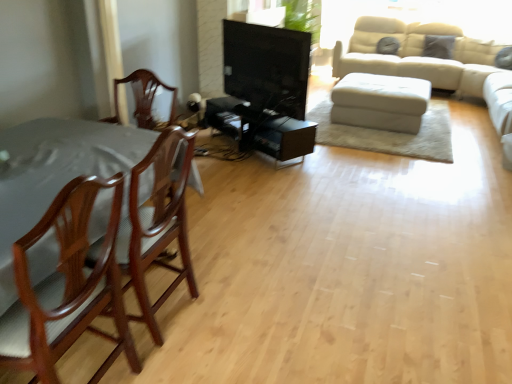
This screenshot has width=512, height=384. What do you see at coordinates (67, 287) in the screenshot? I see `mahogany wood chair at left, the second chair positioned from the back` at bounding box center [67, 287].

What do you see at coordinates (158, 223) in the screenshot? The image size is (512, 384). I see `mahogany wood chair at left, which is the first chair from back to front` at bounding box center [158, 223].

This screenshot has height=384, width=512. What do you see at coordinates (380, 102) in the screenshot?
I see `white leather ottoman at center` at bounding box center [380, 102].

Identify the location of mahogany wood chair at left, the second chair positioned from the back. This screenshot has height=384, width=512. (67, 287).

Between point (411, 124) and point (307, 37), which one is positioned behind?

The point (411, 124) is more distant.

Could you tell me if white leather ottoman at center is turned towards black glossy tv stand at center?

No, white leather ottoman at center is not facing towards black glossy tv stand at center.

Is white leather ottoman at center far from black glossy tv stand at center?

Yes, white leather ottoman at center and black glossy tv stand at center are quite far apart.

Which of these two, white leather ottoman at center or black glossy tv stand at center, is bigger?

white leather ottoman at center is bigger.

In the image, is white leather ottoman at center on the left side or the right side of mahogany wood chair at left, the second chair viewed from the front?

From the image, it's evident that white leather ottoman at center is to the right of mahogany wood chair at left, the second chair viewed from the front.

Is the surface of white leather ottoman at center in direct contact with mahogany wood chair at left, the second chair viewed from the front?

There is a gap between white leather ottoman at center and mahogany wood chair at left, the second chair viewed from the front.

From the image's perspective, which is above, white leather ottoman at center or mahogany wood chair at left, the second chair viewed from the front?

white leather ottoman at center is shown above in the image.

Would you say white leather ottoman at center contains mahogany wood chair at left, the second chair viewed from the front?

Definitely not — mahogany wood chair at left, the second chair viewed from the front, is not inside white leather ottoman at center.

Who is shorter, mahogany wood chair at left, which is the first chair from back to front, or black glossy tv stand at center?

Standing shorter between the two is black glossy tv stand at center.

From the image's perspective, which object appears higher, mahogany wood chair at left, the second chair viewed from the front, or black glossy tv stand at center?

black glossy tv stand at center is shown above in the image.

Considering the relative sizes of mahogany wood chair at left, the second chair viewed from the front, and black glossy tv stand at center in the image provided, is mahogany wood chair at left, the second chair viewed from the front, smaller than black glossy tv stand at center?

No, mahogany wood chair at left, the second chair viewed from the front, is not smaller than black glossy tv stand at center.

Considering the relative positions of mahogany wood chair at left, the second chair viewed from the front, and black glossy tv stand at center in the image provided, is mahogany wood chair at left, the second chair viewed from the front, behind black glossy tv stand at center?

No, mahogany wood chair at left, the second chair viewed from the front, is in front of black glossy tv stand at center.

Between point (255, 128) and point (164, 237), which one is positioned behind?

The point (255, 128) is behind.

Measure the distance between black glossy tv stand at center and mahogany wood chair at left, which is the first chair from back to front.

6.34 feet.

Which of these two, black glossy tv stand at center or mahogany wood chair at left, the second chair viewed from the front, is bigger?

Bigger between the two is mahogany wood chair at left, the second chair viewed from the front.

Between black glossy tv stand at center and mahogany wood chair at left, which is the first chair from back to front, which one has less height?

black glossy tv stand at center.

Is white leather ottoman at center aimed at mahogany wood chair at left, the second chair positioned from the back?

Yes, white leather ottoman at center is turned towards mahogany wood chair at left, the second chair positioned from the back.

From a real-world perspective, count 1st chairs upward from the white leather ottoman at center and point to it. Please provide its 2D coordinates.

[(67, 287)]

Is point (416, 92) positioned before point (35, 342)?

No, it is behind (35, 342).

Which of these two, black glossy tv stand at center or white leather ottoman at center, is wider?

white leather ottoman at center.

From the image's perspective, is black glossy tv stand at center below white leather ottoman at center?

No, from the image's perspective, black glossy tv stand at center is not below white leather ottoman at center.

Is white leather ottoman at center at the back of black glossy tv stand at center?

black glossy tv stand at center is not turned away from white leather ottoman at center.

Can you confirm if mahogany wood chair at left, the first chair positioned from the front, is smaller than black glossy tv stand at center?

No, mahogany wood chair at left, the first chair positioned from the front, is not smaller than black glossy tv stand at center.

Which is behind, point (87, 191) or point (273, 129)?

The point (273, 129) is behind.

From the picture: Does mahogany wood chair at left, the first chair positioned from the front, appear on the left side of black glossy tv stand at center?

Indeed, mahogany wood chair at left, the first chair positioned from the front, is positioned on the left side of black glossy tv stand at center.

In the image, there is a black glossy tv stand at center. Find the location of `the footrest below it (from a real-world perspective)`. the footrest below it (from a real-world perspective) is located at coordinates (380, 102).

From a real-world perspective, starting from the white leather ottoman at center, which chair is the 2nd one vertically above it? Please provide its 2D coordinates.

[(158, 223)]

When comparing their distances from mahogany wood chair at left, the first chair positioned from the front, does white leather ottoman at center or mahogany wood chair at left, which is the first chair from back to front, seem further?

white leather ottoman at center lies further to mahogany wood chair at left, the first chair positioned from the front, than the other object.

Estimate the real-world distances between objects in this image. Which object is further from white leather ottoman at center, black glossy tv stand at center or mahogany wood chair at left, which is the first chair from back to front?

mahogany wood chair at left, which is the first chair from back to front, lies further to white leather ottoman at center than the other object.

Which object lies nearer to the anchor point mahogany wood chair at left, the first chair positioned from the front, black glossy tv stand at center or mahogany wood chair at left, the second chair viewed from the front?

The object closer to mahogany wood chair at left, the first chair positioned from the front, is mahogany wood chair at left, the second chair viewed from the front.

Considering their positions, is mahogany wood chair at left, the first chair positioned from the front, positioned further to black glossy tv stand at center than mahogany wood chair at left, the second chair viewed from the front?

mahogany wood chair at left, the first chair positioned from the front.

Estimate the real-world distances between objects in this image. Which object is further from mahogany wood chair at left, the first chair positioned from the front, mahogany wood chair at left, the second chair viewed from the front, or white leather ottoman at center?

Based on the image, white leather ottoman at center appears to be further to mahogany wood chair at left, the first chair positioned from the front.

Looking at the image, which one is located further to black glossy tv stand at center, white leather ottoman at center or mahogany wood chair at left, the first chair positioned from the front?

mahogany wood chair at left, the first chair positioned from the front, is further to black glossy tv stand at center.

Based on their spatial positions, is white leather ottoman at center or mahogany wood chair at left, the first chair positioned from the front, further from mahogany wood chair at left, which is the first chair from back to front?

Among the two, white leather ottoman at center is located further to mahogany wood chair at left, which is the first chair from back to front.

Estimate the real-world distances between objects in this image. Which object is further from white leather ottoman at center, black glossy tv stand at center or mahogany wood chair at left, the second chair positioned from the back?

Based on the image, mahogany wood chair at left, the second chair positioned from the back, appears to be further to white leather ottoman at center.

The height and width of the screenshot is (384, 512). I want to click on chair between mahogany wood chair at left, the first chair positioned from the front, and black glossy tv stand at center in the front-back direction, so click(158, 223).

Locate an element on the screen. chair between mahogany wood chair at left, the first chair positioned from the front, and white leather ottoman at center, along the z-axis is located at coordinates (158, 223).

Where is `entertainment center located between mahogany wood chair at left, the first chair positioned from the front, and white leather ottoman at center in the depth direction`? entertainment center located between mahogany wood chair at left, the first chair positioned from the front, and white leather ottoman at center in the depth direction is located at coordinates (265, 90).

Identify the location of entertainment center between mahogany wood chair at left, which is the first chair from back to front, and white leather ottoman at center, along the z-axis. Image resolution: width=512 pixels, height=384 pixels. (265, 90).